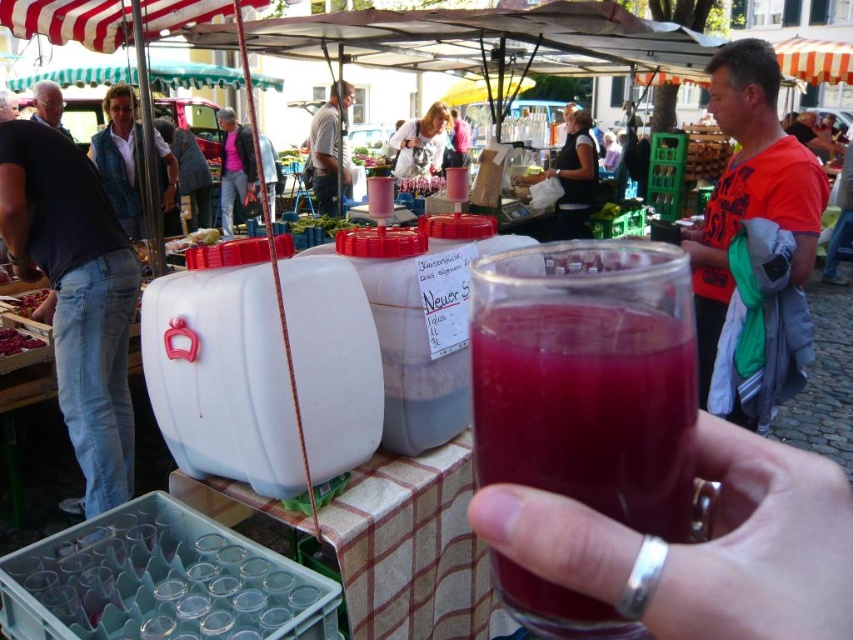
You are at the juice stall and want to choose between the pink fabric jacket at upper center and the ripe red berries at lower left. Which item is bigger?

The pink fabric jacket at upper center is larger in size compared to the ripe red berries at lower left.

You are a customer at the juice stall and want to point out the gray hair at upper left and the smooth red berries at lower left to the vendor. Which of these two items is positioned higher in the image?

The gray hair at upper left is positioned higher in the image than the smooth red berries at lower left.

You are standing at the juice stall and want to reach a point that is exactly 8.60 meters away from you. Can you confirm if the point at coordinates point (247, 184) is the correct location to aim for?

The point (247, 184) is exactly 8.60 meters away from the viewer, so yes, aiming for point (247, 184) will reach the desired distance.